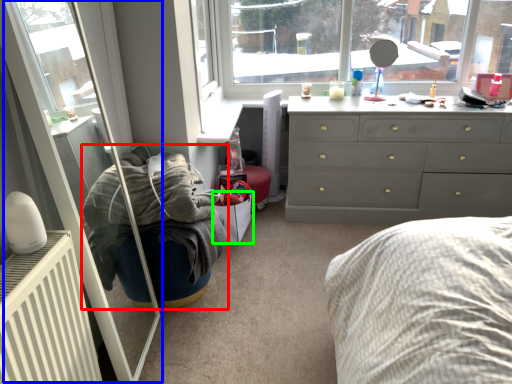
Question: Considering the real-world distances, which object is farthest from bean bag chair (highlighted by a red box)? screen door (highlighted by a blue box) or shoe box (highlighted by a green box)?

Choices:
 (A) screen door
 (B) shoe box

Answer: (B)